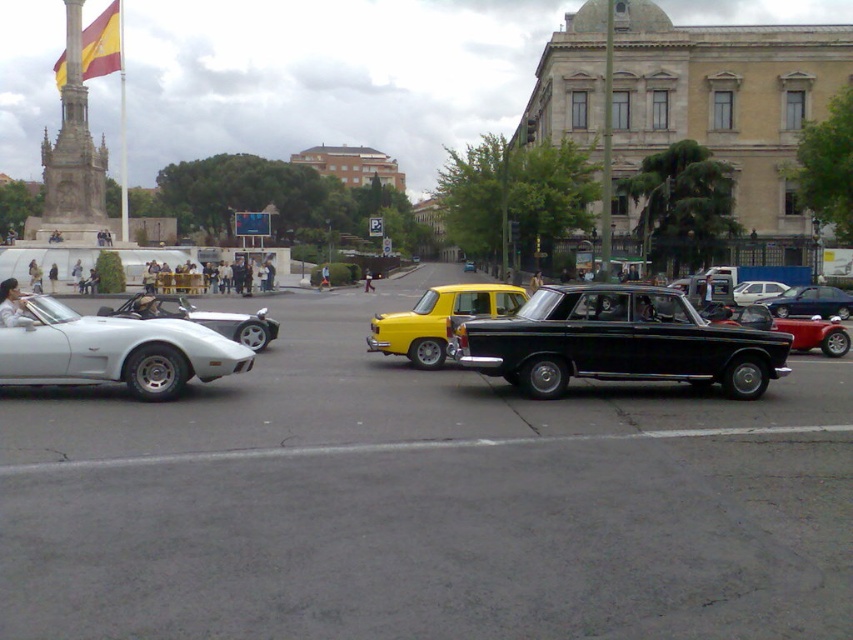
Which is more to the left, shiny black car at center or white glossy sports car at left?

Answer: Positioned to the left is white glossy sports car at left.

Who is lower down, shiny black car at center or white glossy sports car at left?

white glossy sports car at left is below.

The height and width of the screenshot is (640, 853). What do you see at coordinates (614, 342) in the screenshot?
I see `shiny black car at center` at bounding box center [614, 342].

The height and width of the screenshot is (640, 853). What are the coordinates of `shiny black car at center` in the screenshot? It's located at (614, 342).

Does shiny black car at center have a smaller size compared to shiny silver sports car at left?

Correct, shiny black car at center occupies less space than shiny silver sports car at left.

Does point (669, 365) come farther from viewer compared to point (229, 323)?

No, (669, 365) is in front of (229, 323).

Does point (532, 371) come farther from viewer compared to point (128, 314)?

No, (532, 371) is in front of (128, 314).

The height and width of the screenshot is (640, 853). Find the location of `shiny black car at center`. shiny black car at center is located at coordinates (614, 342).

Between white glossy sports car at left and shiny silver sports car at left, which one appears on the right side from the viewer's perspective?

Positioned to the right is white glossy sports car at left.

Locate an element on the screen. This screenshot has height=640, width=853. white glossy sports car at left is located at coordinates (113, 352).